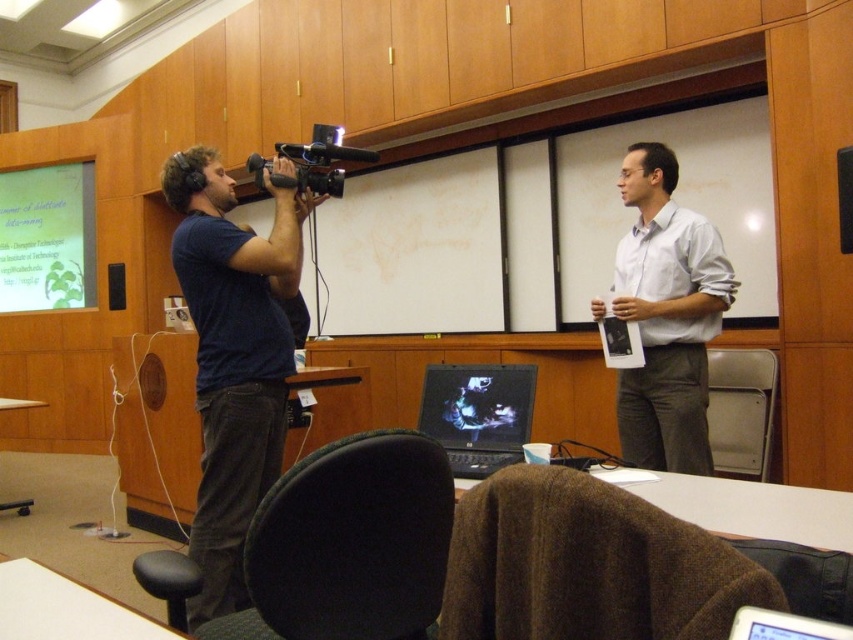
Question: Is dark blue t-shirt at left to the right of white matte shirt at center from the viewer's perspective?

Choices:
 (A) yes
 (B) no

Answer: (B)

Question: Which is nearer to the white matte shirt at center?

Choices:
 (A) dark blue t-shirt at left
 (B) green matte projection screen at upper left
 (C) black glossy laptop at center

Answer: (C)

Question: Which object appears closest to the camera in this image?

Choices:
 (A) green matte projection screen at upper left
 (B) black plastic video camera at center
 (C) dark blue t-shirt at left
 (D) white matte shirt at center

Answer: (C)

Question: Is white matte shirt at center thinner than green matte projection screen at upper left?

Choices:
 (A) no
 (B) yes

Answer: (B)

Question: Can you confirm if green matte projection screen at upper left is bigger than black plastic video camera at center?

Choices:
 (A) yes
 (B) no

Answer: (A)

Question: Considering the real-world distances, which object is farthest from the green matte projection screen at upper left?

Choices:
 (A) white matte shirt at center
 (B) black plastic video camera at center

Answer: (A)